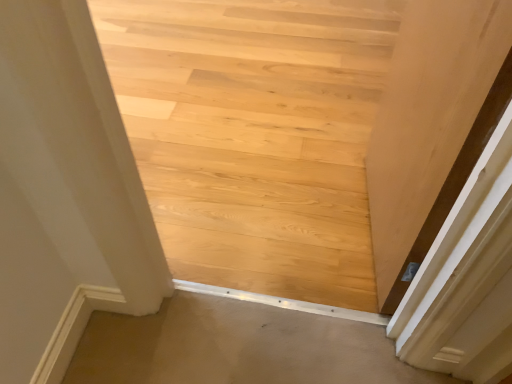
Question: From the image's perspective, does natural wood floor at center appear lower than matte wood door at right?

Choices:
 (A) yes
 (B) no

Answer: (B)

Question: Does natural wood floor at center have a lesser width compared to matte wood door at right?

Choices:
 (A) no
 (B) yes

Answer: (A)

Question: From the image's perspective, does natural wood floor at center appear higher than matte wood door at right?

Choices:
 (A) no
 (B) yes

Answer: (B)

Question: Can you confirm if natural wood floor at center is shorter than matte wood door at right?

Choices:
 (A) no
 (B) yes

Answer: (B)

Question: Is natural wood floor at center facing towards matte wood door at right?

Choices:
 (A) no
 (B) yes

Answer: (A)

Question: From a real-world perspective, is matte wood door at right positioned above or below natural wood floor at center?

Choices:
 (A) above
 (B) below

Answer: (A)

Question: In terms of height, does matte wood door at right look taller or shorter compared to natural wood floor at center?

Choices:
 (A) tall
 (B) short

Answer: (A)

Question: Is matte wood door at right in front of or behind natural wood floor at center in the image?

Choices:
 (A) front
 (B) behind

Answer: (A)

Question: Is matte wood door at right to the left or to the right of natural wood floor at center in the image?

Choices:
 (A) left
 (B) right

Answer: (B)

Question: Relative to matte wood door at right, is beige carpet at lower center in front or behind?

Choices:
 (A) behind
 (B) front

Answer: (A)

Question: Considering the positions of point (165, 377) and point (492, 72), is point (165, 377) closer or farther from the camera than point (492, 72)?

Choices:
 (A) farther
 (B) closer

Answer: (A)

Question: From the image's perspective, relative to matte wood door at right, is beige carpet at lower center above or below?

Choices:
 (A) below
 (B) above

Answer: (A)

Question: In terms of height, does beige carpet at lower center look taller or shorter compared to matte wood door at right?

Choices:
 (A) tall
 (B) short

Answer: (B)

Question: Considering the positions of natural wood floor at center and beige carpet at lower center in the image, is natural wood floor at center wider or thinner than beige carpet at lower center?

Choices:
 (A) wide
 (B) thin

Answer: (A)

Question: Considering the relative positions of natural wood floor at center and beige carpet at lower center in the image provided, is natural wood floor at center to the left or to the right of beige carpet at lower center?

Choices:
 (A) left
 (B) right

Answer: (A)